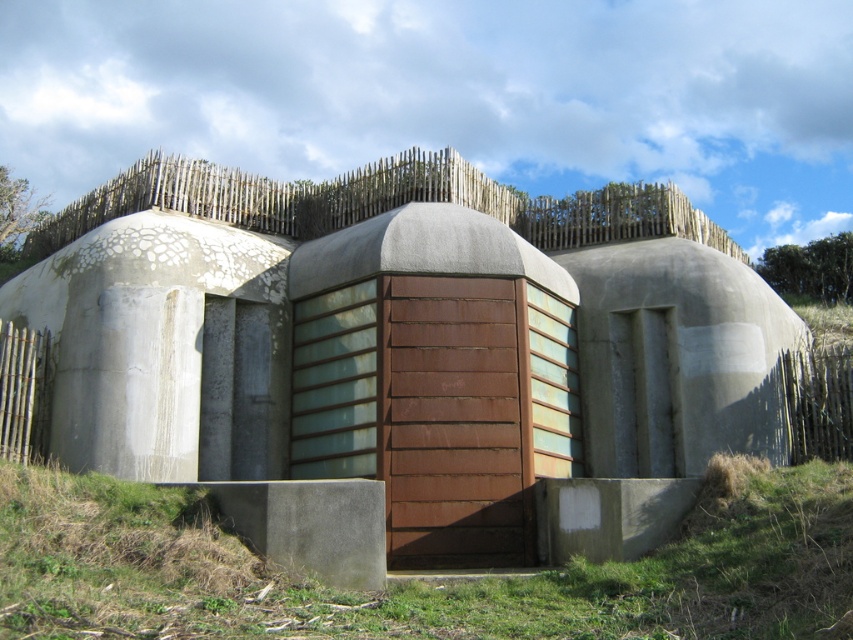
Where is `rusty metal door at center`? The height and width of the screenshot is (640, 853). rusty metal door at center is located at coordinates (404, 356).

Who is lower down, rusty metal door at center or green grass at lower center?

green grass at lower center is lower down.

I want to click on rusty metal door at center, so click(x=404, y=356).